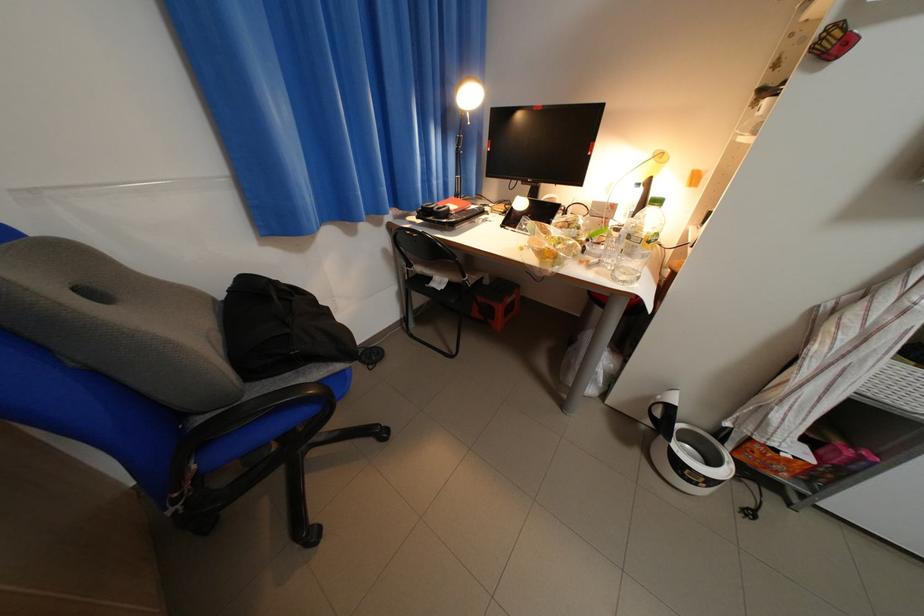
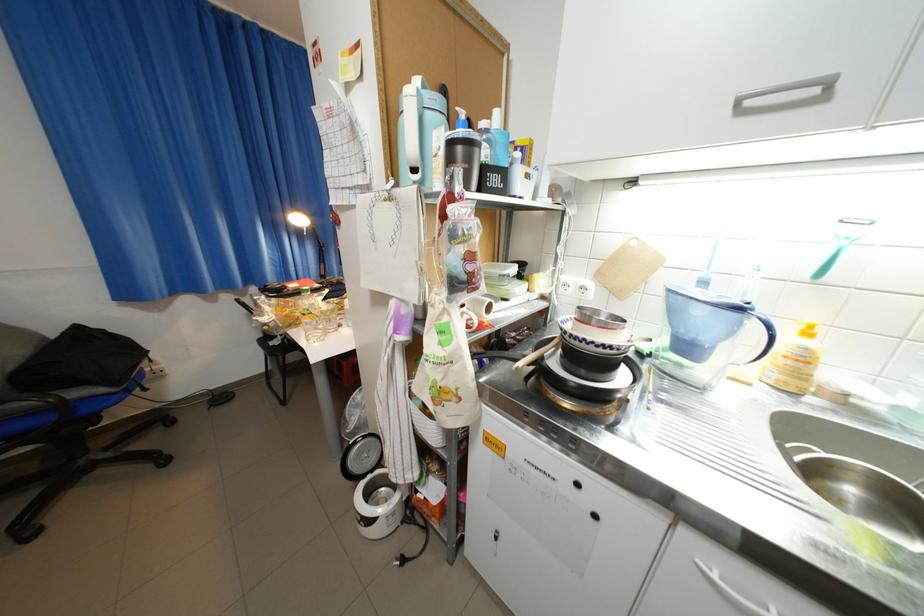
Question: In a continuous first-person perspective shot, in which direction is the camera moving?

Choices:
 (A) Left
 (B) Right
 (C) Forward
 (D) Backward

Answer: (B)